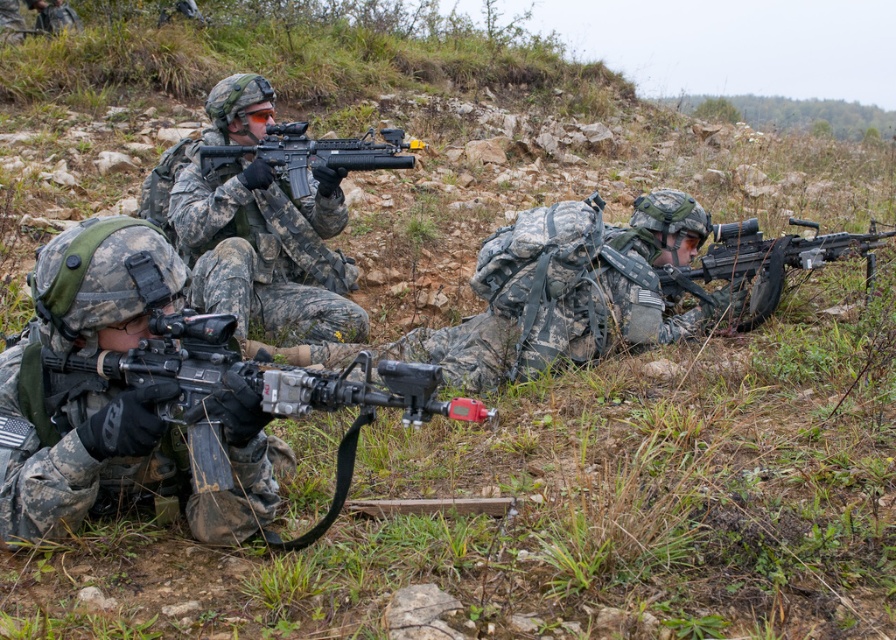
Question: Can you confirm if camouflage uniform at center is wider than black matte rifle at center?

Choices:
 (A) no
 (B) yes

Answer: (A)

Question: Based on their relative distances, which object is farther from the black matte rifle at center?

Choices:
 (A) matte black machine gun at right
 (B) camouflage fabric rifle at lower left
 (C) matte black machine gun at lower left
 (D) camouflage uniform at center

Answer: (C)

Question: Where is camouflage fabric rifle at lower left located in relation to black matte rifle at center in the image?

Choices:
 (A) right
 (B) left

Answer: (B)

Question: Which of these objects is positioned closest to the matte black machine gun at right?

Choices:
 (A) camouflage fabric rifle at lower left
 (B) matte black machine gun at lower left
 (C) camouflage uniform at center

Answer: (C)

Question: Is camouflage fabric rifle at lower left to the left of matte black machine gun at lower left from the viewer's perspective?

Choices:
 (A) no
 (B) yes

Answer: (B)

Question: Which object is closer to the camera taking this photo?

Choices:
 (A) black matte rifle at center
 (B) matte black machine gun at lower left
 (C) camouflage uniform at center
 (D) matte black machine gun at right

Answer: (B)